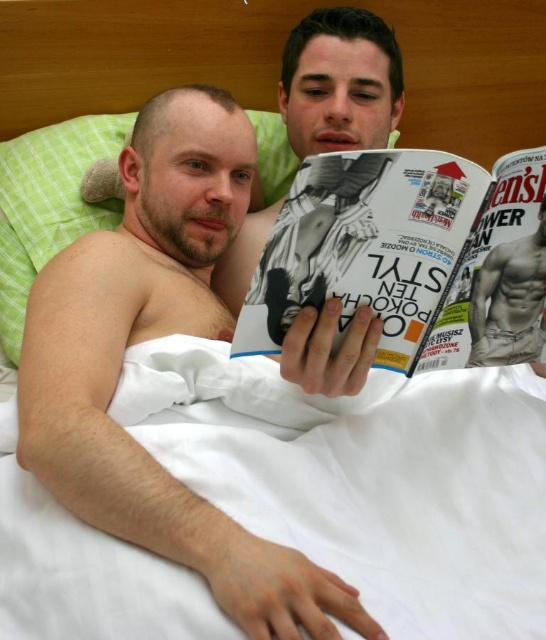
You are a photographer standing at the entrance of the room. You want to take a photo of the scene so that the white glossy magazine at center is centered in the frame. Based on its current position, where should you stand to ensure the magazine is centered?

Since the white glossy magazine at center is already positioned at point (366, 248), you should position yourself so that your camera is aligned with those coordinates to center the magazine in the frame.

You are designing a shelf to display the white glossy magazine at center and the green fabric pillow at upper left. If the shelf has a height limit of 10 cm, will both items fit vertically without overlapping?

The white glossy magazine at center is shorter than the green fabric pillow at upper left. Since the shelf has a height limit of 10 cm, we need to know the exact heights of both items. However, since the magazine is shorter than the pillow, if the pillow is under 10 cm, both could fit. But without specific measurements, we can only say that the magazine will fit if the pillow does, but the pillow might exceed the limit. More information is needed.

You are a photographer who needs to capture a closeup shot of the white glossy magazine at center without the muscular skin torso at center appearing in the frame. Given that the distance between them is 5.12 inches, what is the minimum focal length your camera lens should have to achieve this?

The minimum focal length required would depend on the sensor size of your camera and the desired field of view. However, since the objects are 5.12 inches apart, using a lens with a focal length of at least 50mm on a full frame camera could help isolate the magazine while keeping the torso out of the frame, assuming proper positioning.